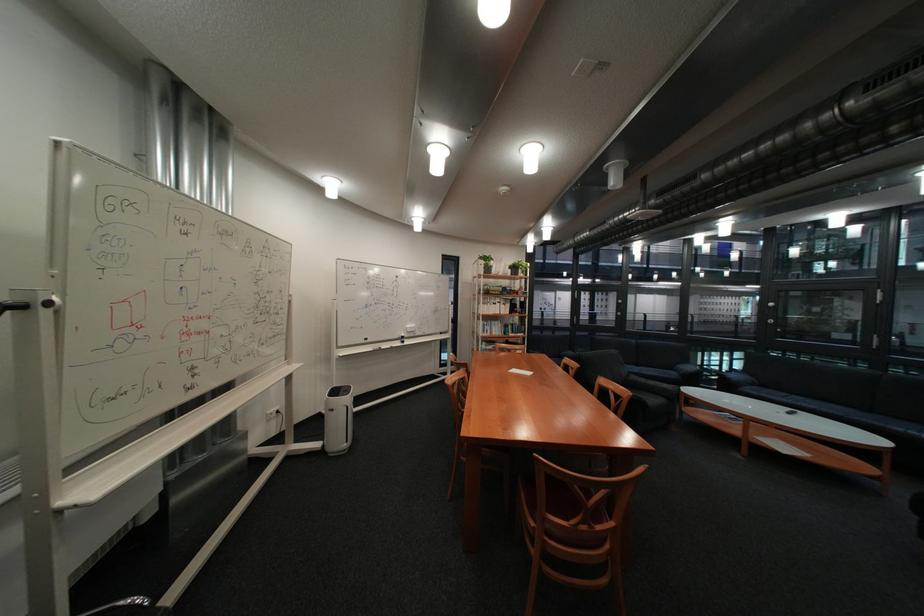
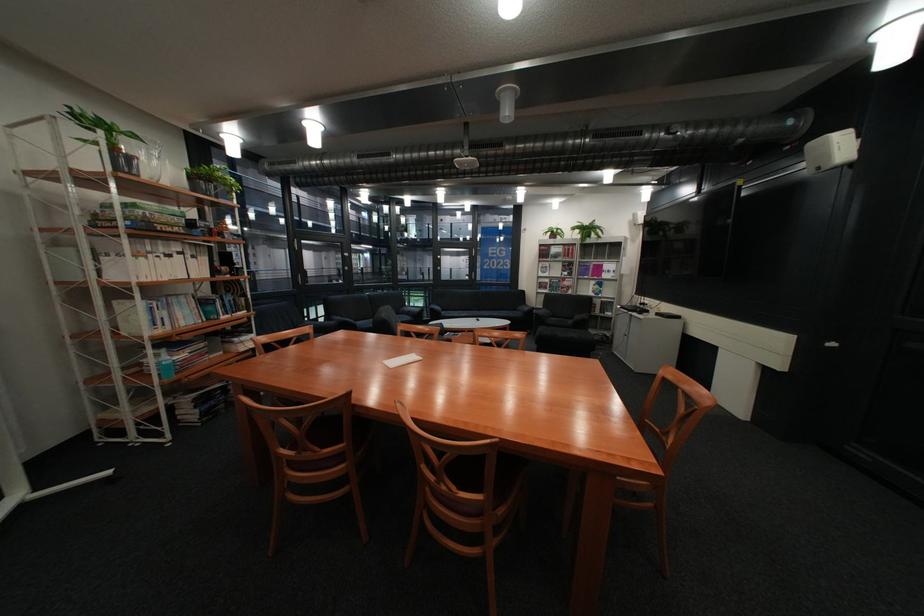
In the second image, find the point that corresponds to (506,273) in the first image.

(152, 177)